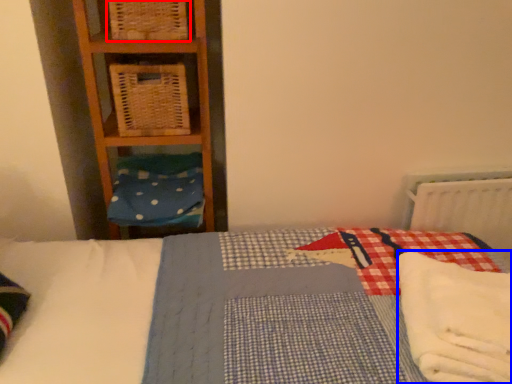
Question: Which object appears farthest to the camera in this image, crate (highlighted by a red box) or material (highlighted by a blue box)?

Choices:
 (A) crate
 (B) material

Answer: (A)